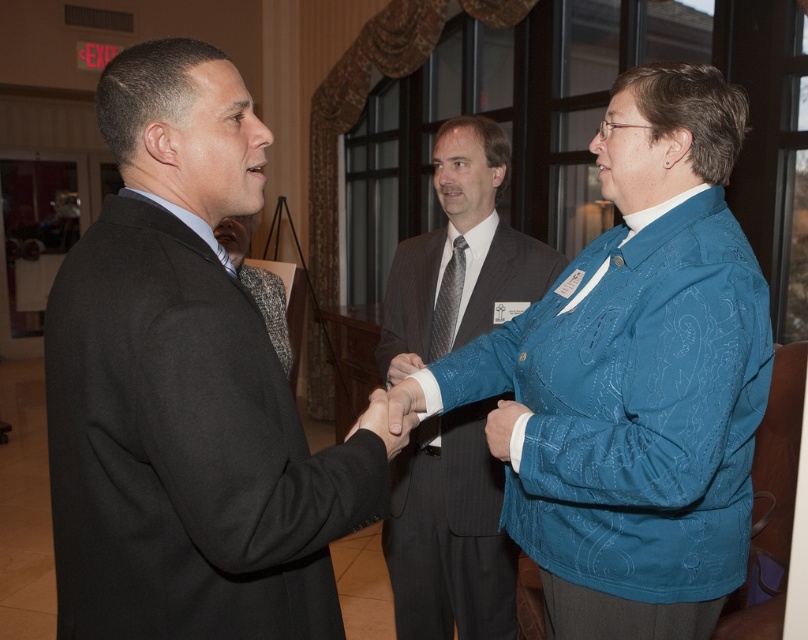
Question: Is dark gray pinstripe suit at center to the left of matte black hand at center from the viewer's perspective?

Choices:
 (A) no
 (B) yes

Answer: (A)

Question: Which point is farther from the camera taking this photo?

Choices:
 (A) (457, 246)
 (B) (512, 433)
 (C) (271, 342)
 (D) (398, 428)

Answer: (A)

Question: Which point appears closest to the camera in this image?

Choices:
 (A) (678, 456)
 (B) (404, 355)
 (C) (365, 422)

Answer: (C)

Question: Is gray tweed suit at center to the left of gray textured tie at center from the viewer's perspective?

Choices:
 (A) yes
 (B) no

Answer: (A)

Question: Does dark gray pinstripe suit at center appear under gray tweed suit at center?

Choices:
 (A) no
 (B) yes

Answer: (B)

Question: Which of these objects is positioned farthest from the dark gray pinstripe suit at center?

Choices:
 (A) matte black suit at center
 (B) matte black hand at center
 (C) gray textured tie at center
 (D) gray tweed suit at center

Answer: (B)